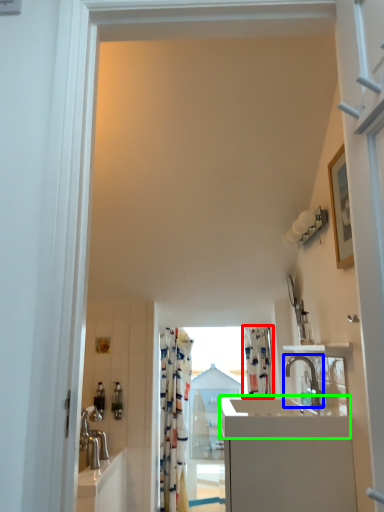
Question: Considering the real-world distances, which object is farthest from shower curtain (highlighted by a red box)? tap (highlighted by a blue box) or counter top (highlighted by a green box)?

Choices:
 (A) tap
 (B) counter top

Answer: (B)